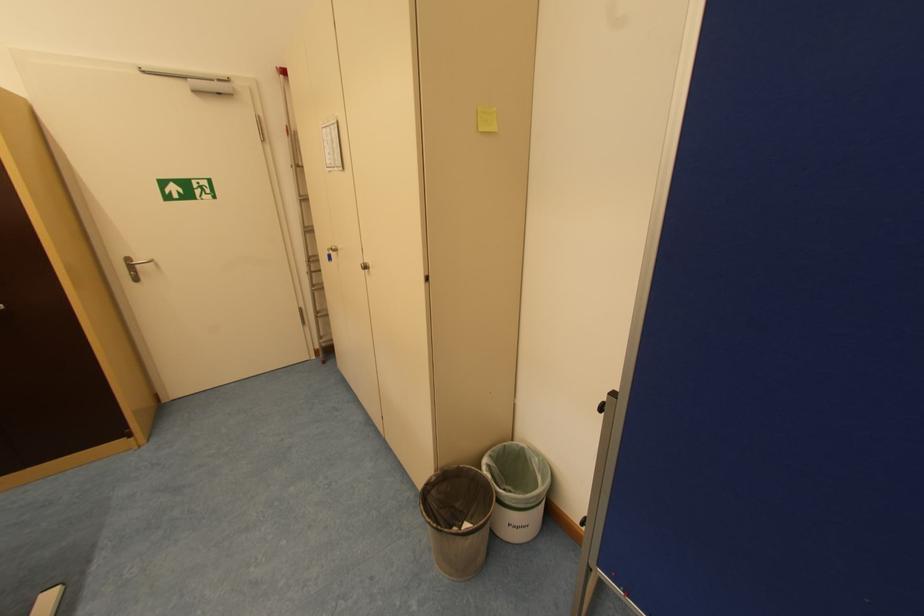
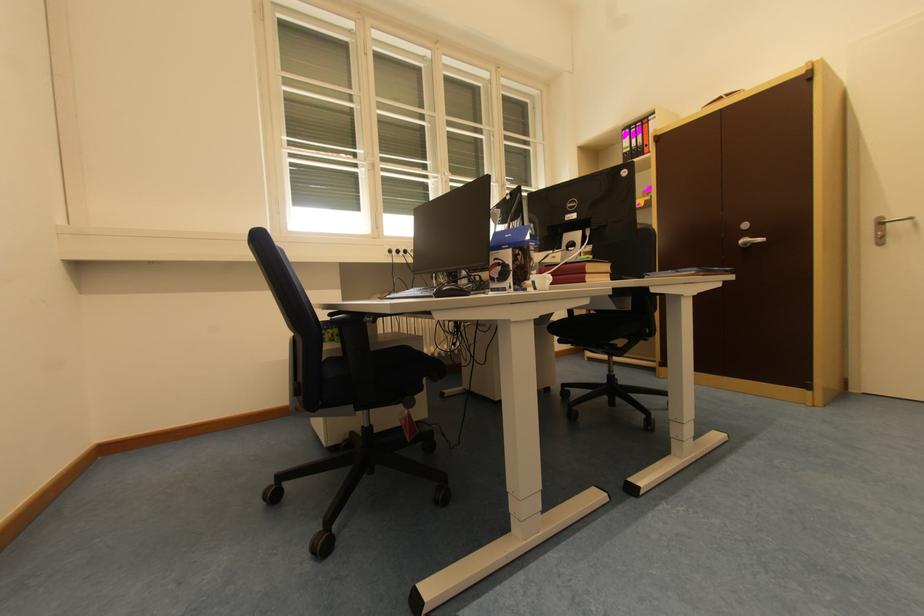
Question: Based on the continuous images, in which direction is the camera rotating? Reply with the corresponding letter.

Choices:
 (A) Left
 (B) Right
 (C) Up
 (D) Down

Answer: (A)